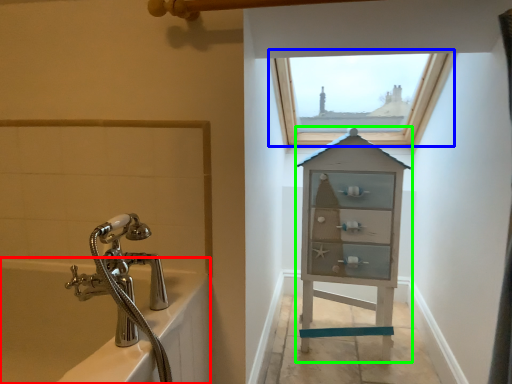
Question: Which object is positioned closest to bath (highlighted by a red box)? Select from window (highlighted by a blue box) and medicine cabinet (highlighted by a green box).

Choices:
 (A) window
 (B) medicine cabinet

Answer: (B)